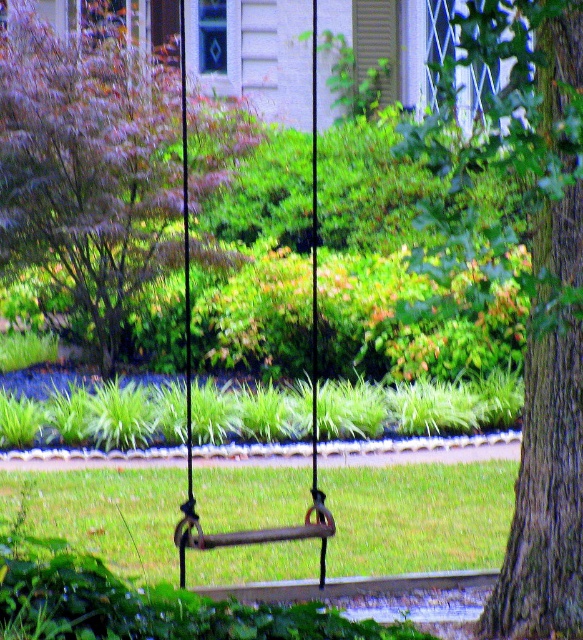
Between point (561, 227) and point (29, 13), which one is positioned in front?

Point (561, 227)

Looking at this image, how much distance is there between brown textured bark at right and purple leafy tree at upper left?

9.37 feet

Does point (497, 200) come behind point (117, 250)?

That is True.

I want to click on brown textured bark at right, so click(x=522, y=276).